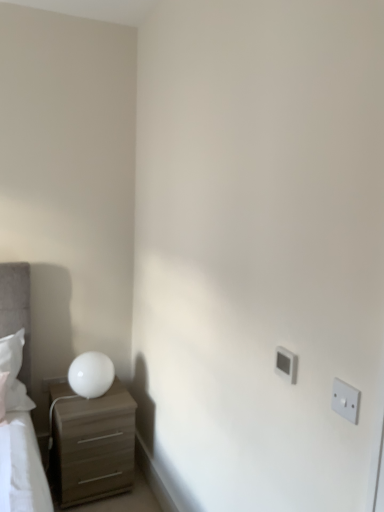
Where is `blank space situated above matte brown chest of drawers at lower left (from a real-world perspective)`? blank space situated above matte brown chest of drawers at lower left (from a real-world perspective) is located at coordinates (92, 402).